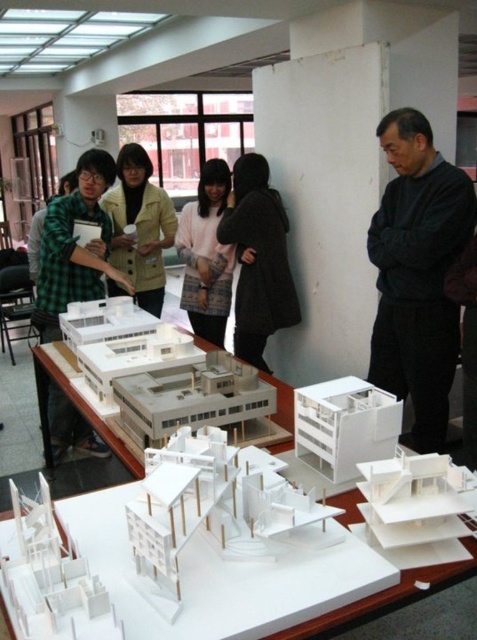
Question: Which point appears closest to the camera in this image?

Choices:
 (A) (85, 193)
 (B) (151, 211)
 (C) (245, 218)
 (D) (9, 442)

Answer: (A)

Question: Which point appears closest to the camera in this image?

Choices:
 (A) (464, 264)
 (B) (63, 429)

Answer: (A)

Question: Does black matte coat at center appear under black matte jacket at upper right?

Choices:
 (A) no
 (B) yes

Answer: (A)

Question: Is green checkered shirt at left bigger than light yellow button-up shirt at center?

Choices:
 (A) yes
 (B) no

Answer: (A)

Question: Is black sweater at right above white paper model at center?

Choices:
 (A) no
 (B) yes

Answer: (B)

Question: Which of the following is the farthest from the observer?

Choices:
 (A) black sweater at right
 (B) pink fabric jacket at center

Answer: (B)